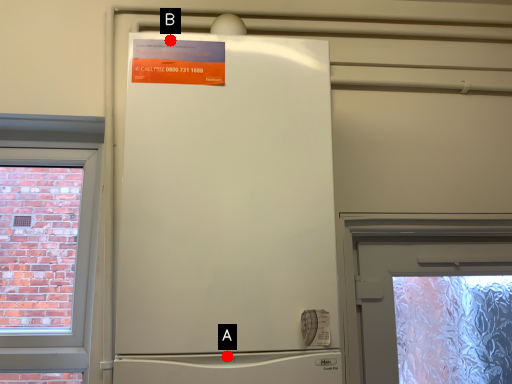
Question: Two points are circled on the image, labeled by A and B beside each circle. Which point is further to the camera?

Choices:
 (A) A is further
 (B) B is further

Answer: (B)